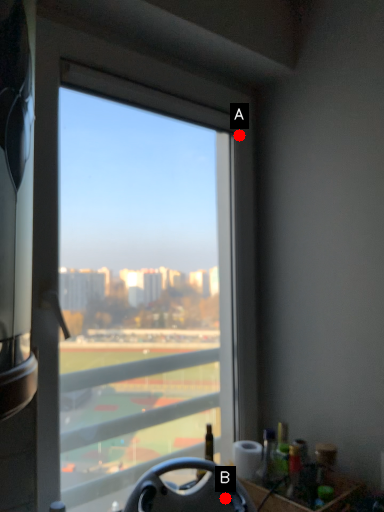
Question: Two points are circled on the image, labeled by A and B beside each circle. Which of the following is the farthest from the observer?

Choices:
 (A) A is further
 (B) B is further

Answer: (A)